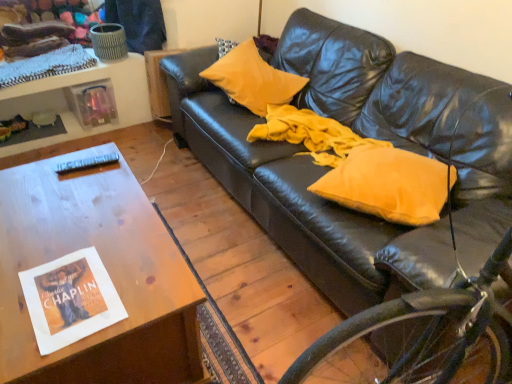
Where is `free point in front of black plastic remote control at upper left`? free point in front of black plastic remote control at upper left is located at coordinates (70, 187).